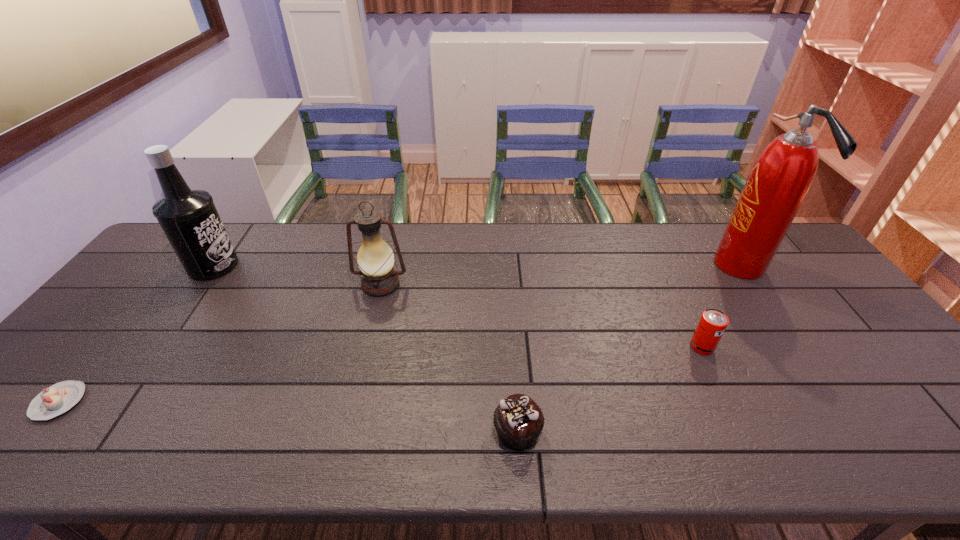
Locate an element on the screen. This screenshot has width=960, height=540. empty location between the second object from left to right and the leftmost object is located at coordinates (136, 334).

Where is `vacant area between the oil lamp and the can`? The image size is (960, 540). vacant area between the oil lamp and the can is located at coordinates (541, 316).

Image resolution: width=960 pixels, height=540 pixels. Find the location of `free spot between the fire extinguisher and the right cupcake`. free spot between the fire extinguisher and the right cupcake is located at coordinates (629, 349).

Identify the location of unoccupied area between the second object from left to right and the fire extinguisher. This screenshot has width=960, height=540. (477, 266).

In order to click on free area in between the leftmost object and the second object from right to left in this screenshot , I will do click(380, 374).

Find the location of a particular element. The width and height of the screenshot is (960, 540). blank region between the rightmost object and the oil lamp is located at coordinates (561, 276).

Image resolution: width=960 pixels, height=540 pixels. Identify the location of unoccupied area between the tallest object and the fifth object from right to left. click(477, 266).

At what (x,y) coordinates should I click in order to perform the action: click on free space between the fifth object from left to right and the rightmost object. Please return your answer as a coordinate pair (x, y). This screenshot has height=540, width=960. Looking at the image, I should click on (721, 307).

Locate an element on the screen. vacant space in between the third tallest object and the second tallest object is located at coordinates (297, 275).

Identify the location of free space between the fifth object from left to right and the left cupcake. (380, 374).